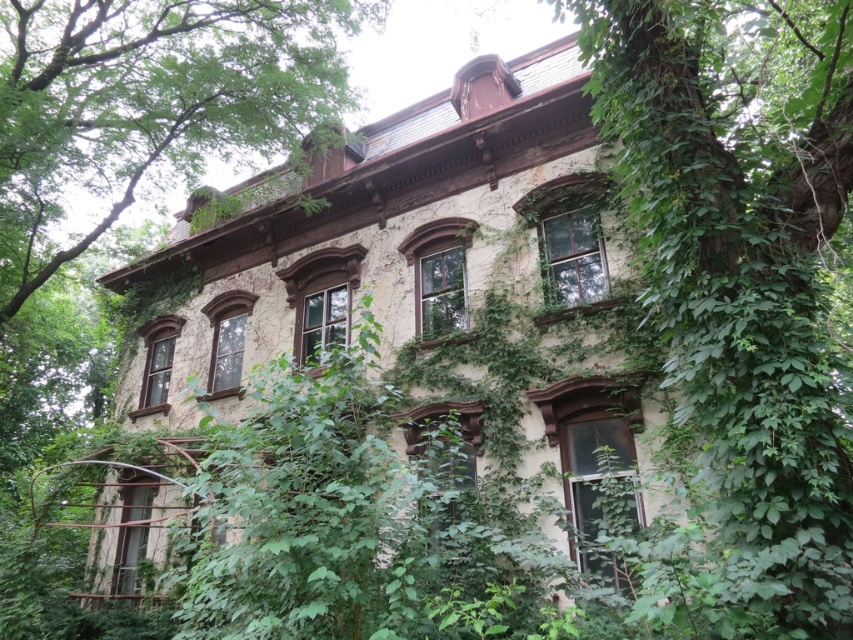
Can you confirm if green leafy vine at center is positioned to the left of green leafy tree at upper center?

No, green leafy vine at center is not to the left of green leafy tree at upper center.

Between green leafy vine at center and green leafy tree at upper center, which one has more height?

With more height is green leafy vine at center.

The height and width of the screenshot is (640, 853). What do you see at coordinates (735, 296) in the screenshot?
I see `green leafy vine at center` at bounding box center [735, 296].

What are the coordinates of `green leafy vine at center` in the screenshot? It's located at (735, 296).